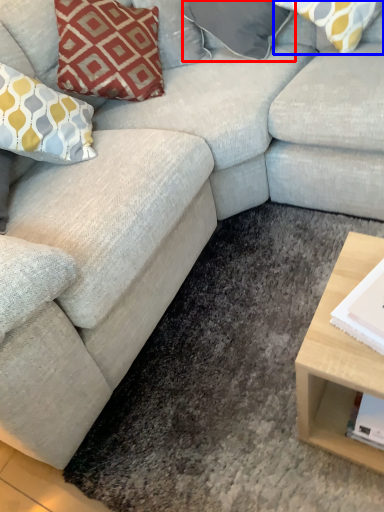
Question: Among these objects, which one is farthest to the camera, pillow (highlighted by a red box) or pillow (highlighted by a blue box)?

Choices:
 (A) pillow
 (B) pillow

Answer: (A)